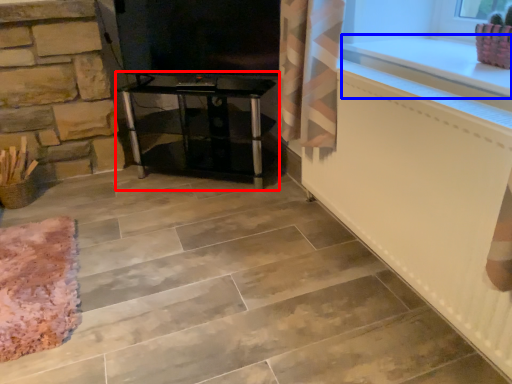
Question: Which object is closer to the camera taking this photo, furniture (highlighted by a red box) or counter top (highlighted by a blue box)?

Choices:
 (A) furniture
 (B) counter top

Answer: (B)